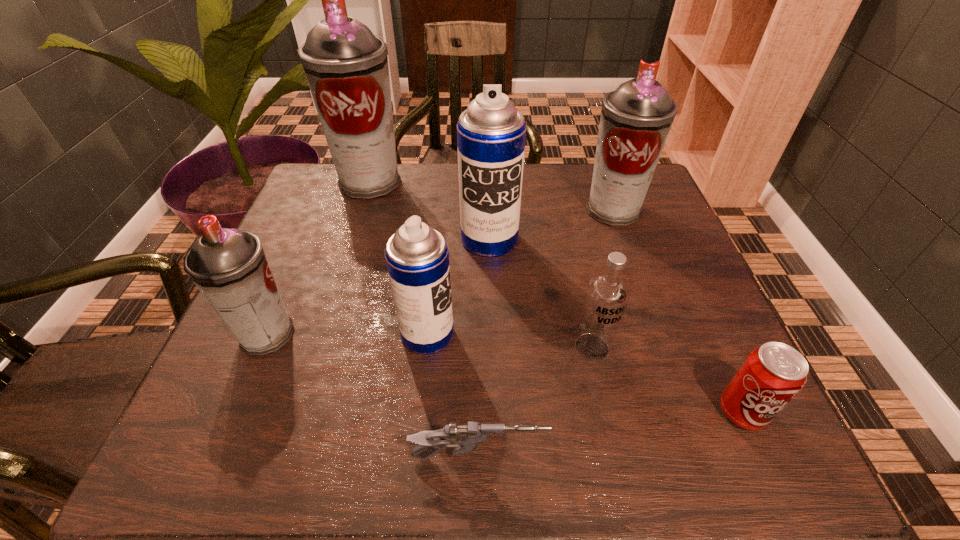
Find the location of `vacant point at the far edge`. vacant point at the far edge is located at coordinates (416, 183).

In the image, there is a desktop. Where is `blank space at the near edge`? blank space at the near edge is located at coordinates (619, 421).

In the image, there is a desktop. In order to click on vacant space at the left edge in this screenshot , I will do `click(208, 382)`.

I want to click on vacant area at the right edge, so click(x=703, y=287).

Find the location of a particular element. vacant space at the near right corner of the desktop is located at coordinates [x=736, y=440].

Find the location of a particular element. The width and height of the screenshot is (960, 540). empty space that is in between the third shortest object and the third aerosol can from right to left is located at coordinates (510, 341).

You are a GUI agent. You are given a task and a screenshot of the screen. Output one action in this format:
    pyautogui.click(x=<x>, y=<y>)
    Task: Click on the free space between the seventh farthest object and the sixth tallest object
    The width and height of the screenshot is (960, 540).
    Given the screenshot: What is the action you would take?
    pyautogui.click(x=666, y=380)

You are a GUI agent. You are given a task and a screenshot of the screen. Output one action in this format:
    pyautogui.click(x=<x>, y=<y>)
    Task: Click on the vacant space that is in between the bigger blue aerosol can and the smallest gray aerosol can
    The image size is (960, 540).
    Given the screenshot: What is the action you would take?
    pyautogui.click(x=378, y=287)

Identify the location of free space between the nearest object and the nearer blue aerosol can. (453, 396).

Find the location of a particular element. The image size is (960, 540). vacant space in between the smallest gray aerosol can and the bigger blue aerosol can is located at coordinates (378, 287).